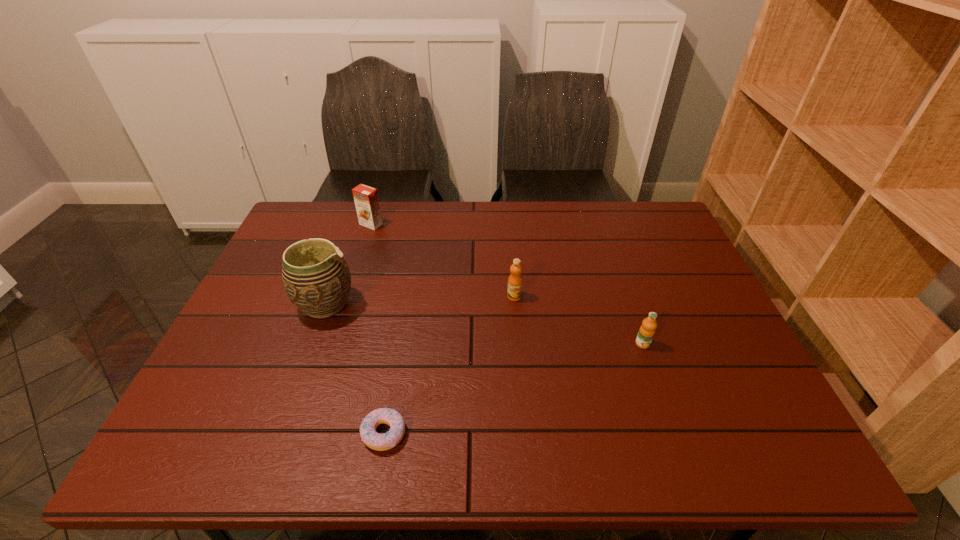
Locate an element on the screen. This screenshot has height=540, width=960. free spot between the shortest object and the pottery is located at coordinates (355, 368).

This screenshot has width=960, height=540. I want to click on empty space that is in between the rightmost orange juice and the second farthest orange juice, so click(x=579, y=320).

Locate an element on the screen. Image resolution: width=960 pixels, height=540 pixels. object that stands as the fourth closest to the pottery is located at coordinates 646,332.

At what (x,y) coordinates should I click in order to perform the action: click on the third closest object to the farthest object. Please return your answer as a coordinate pair (x, y). The height and width of the screenshot is (540, 960). Looking at the image, I should click on (381, 442).

Identify which orange juice is the closest to the fourth object from left to right. Please provide its 2D coordinates. Your answer should be formatted as a tuple, i.e. [(x, y)], where the tuple contains the x and y coordinates of a point satisfying the conditions above.

[(646, 332)]

Select which orange juice appears as the closest to the leftmost orange juice. Please provide its 2D coordinates. Your answer should be formatted as a tuple, i.e. [(x, y)], where the tuple contains the x and y coordinates of a point satisfying the conditions above.

[(515, 281)]

Locate an element on the screen. vacant point that satisfies the following two spatial constraints: 1. on the front side of the nearest object; 2. on the right side of the farthest orange juice is located at coordinates (305, 433).